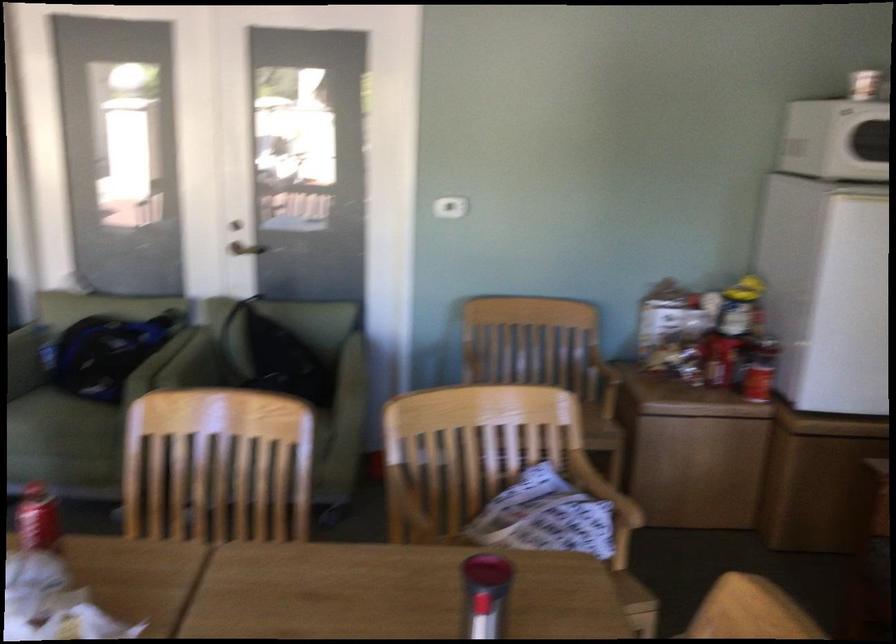
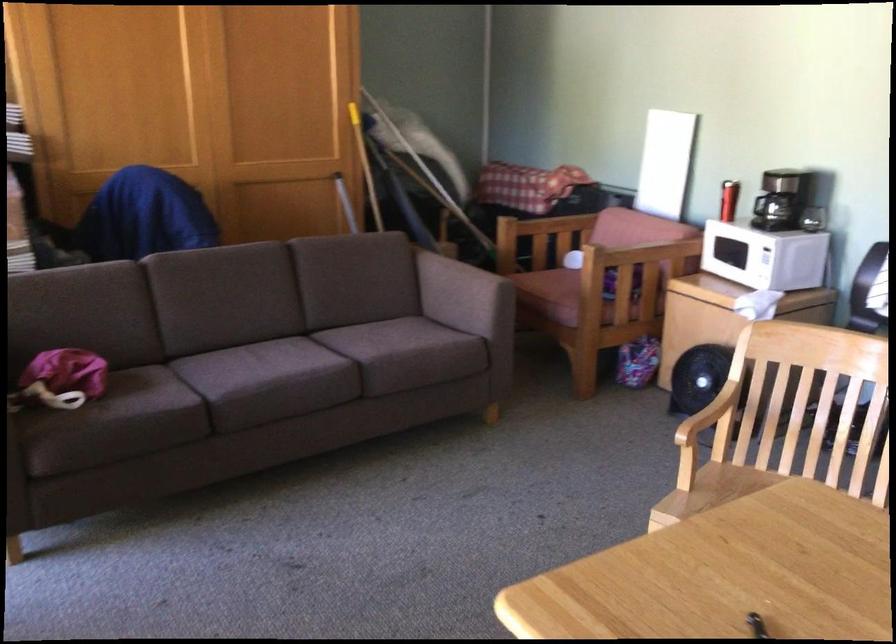
Question: The camera is either moving clockwise (left) or counter-clockwise (right) around the object. The first image is from the beginning of the video and the second image is from the end. Is the camera moving left or right when shooting the video?

Choices:
 (A) Left
 (B) Right

Answer: (B)